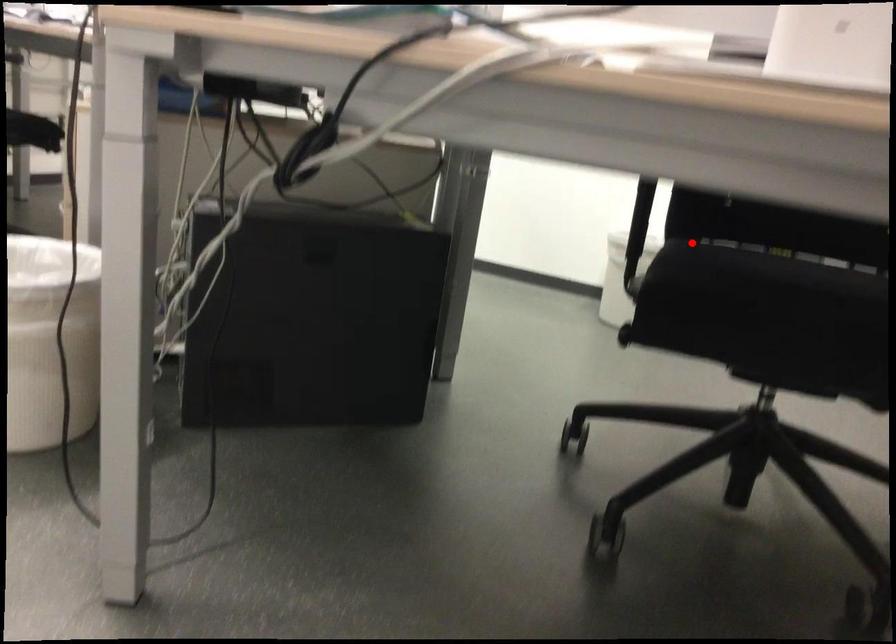
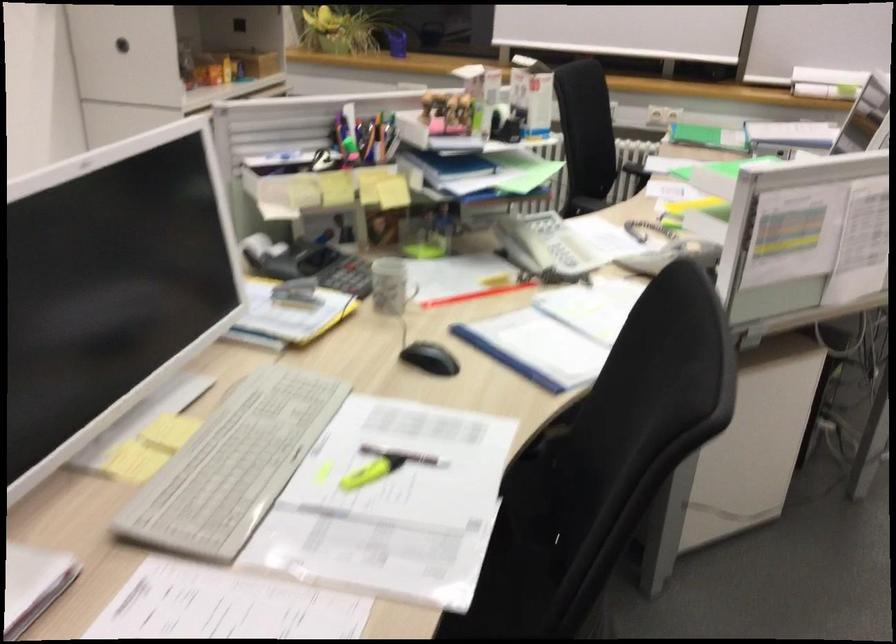
Find the pixel in the second image that matches the highlighted location in the first image.

(518, 554)